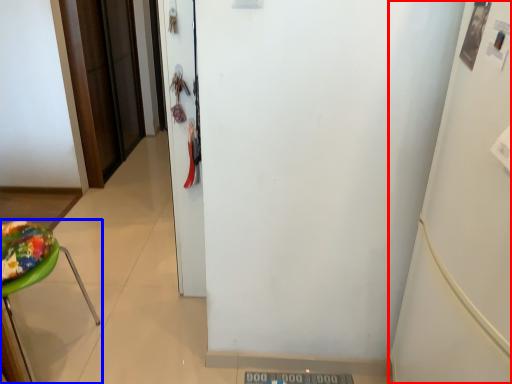
Question: Which point is closer to the camera, fridge (highlighted by a red box) or furniture (highlighted by a blue box)?

Choices:
 (A) fridge
 (B) furniture

Answer: (A)